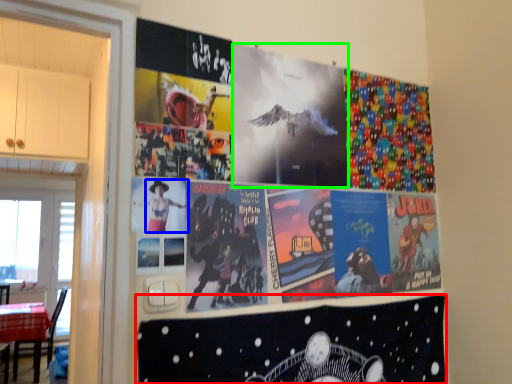
Question: Estimate the real-world distances between objects in this image. Which object is closer to album cover (highlighted by a red box), person (highlighted by a blue box) or movie poster (highlighted by a green box)?

Choices:
 (A) person
 (B) movie poster

Answer: (B)